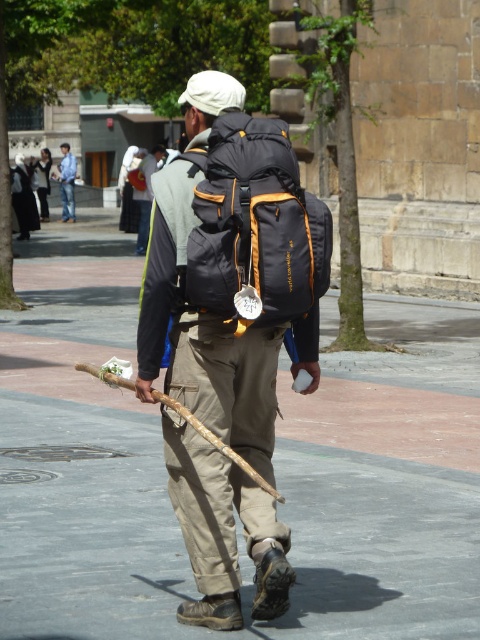
Can you confirm if khaki pants at center is wider than matte gray backpack at center?

Yes, khaki pants at center is wider than matte gray backpack at center.

Is point (304, 208) less distant than point (137, 172)?

That is True.

At what (x,y) coordinates should I click in order to perform the action: click on khaki pants at center. Please return your answer as a coordinate pair (x, y). Image resolution: width=480 pixels, height=640 pixels. Looking at the image, I should click on (231, 268).

Between gray concrete pavement at center and blue denim jeans at center, which one is positioned higher?

blue denim jeans at center is above.

Is gray concrete pavement at center taller than blue denim jeans at center?

In fact, gray concrete pavement at center may be shorter than blue denim jeans at center.

Describe the element at coordinates (274, 465) in the screenshot. I see `gray concrete pavement at center` at that location.

I want to click on gray concrete pavement at center, so click(x=274, y=465).

This screenshot has width=480, height=640. What do you see at coordinates (274, 465) in the screenshot? I see `gray concrete pavement at center` at bounding box center [274, 465].

The width and height of the screenshot is (480, 640). What do you see at coordinates (274, 465) in the screenshot? I see `gray concrete pavement at center` at bounding box center [274, 465].

The width and height of the screenshot is (480, 640). What are the coordinates of `gray concrete pavement at center` in the screenshot? It's located at (274, 465).